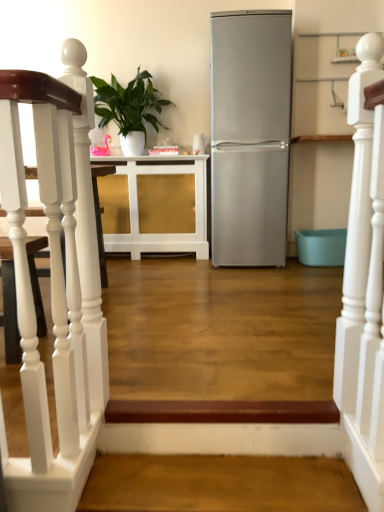
Question: Considering the relative positions of brown wood stairwell at lower center, the first stairwell positioned from the bottom, and white glossy cabinet at center in the image provided, is brown wood stairwell at lower center, the first stairwell positioned from the bottom, to the right of white glossy cabinet at center from the viewer's perspective?

Choices:
 (A) no
 (B) yes

Answer: (B)

Question: Considering the relative sizes of brown wood stairwell at lower center, the 2th stairwell when ordered from top to bottom, and white glossy cabinet at center in the image provided, is brown wood stairwell at lower center, the 2th stairwell when ordered from top to bottom, thinner than white glossy cabinet at center?

Choices:
 (A) yes
 (B) no

Answer: (A)

Question: Could you tell me if brown wood stairwell at lower center, which is the 2th stairwell in left-to-right order, is facing white glossy cabinet at center?

Choices:
 (A) no
 (B) yes

Answer: (A)

Question: Does brown wood stairwell at lower center, the first stairwell positioned from the bottom, touch white glossy cabinet at center?

Choices:
 (A) no
 (B) yes

Answer: (A)

Question: Can you confirm if brown wood stairwell at lower center, the first stairwell positioned from the bottom, is shorter than white glossy cabinet at center?

Choices:
 (A) no
 (B) yes

Answer: (B)

Question: Is white wooden staircase at left, placed as the second stairwell when sorted from bottom to top, inside the boundaries of brown wood stairwell at lower center, which is the 2th stairwell in left-to-right order, or outside?

Choices:
 (A) outside
 (B) inside

Answer: (A)

Question: From the image's perspective, relative to brown wood stairwell at lower center, the first stairwell viewed from the right, is white wooden staircase at left, placed as the second stairwell when sorted from bottom to top, above or below?

Choices:
 (A) below
 (B) above

Answer: (B)

Question: Is point (62, 334) positioned closer to the camera than point (102, 503)?

Choices:
 (A) closer
 (B) farther

Answer: (A)

Question: Looking at the image, does white wooden staircase at left, acting as the 1th stairwell starting from the top, seem bigger or smaller compared to brown wood stairwell at lower center, the first stairwell positioned from the bottom?

Choices:
 (A) small
 (B) big

Answer: (B)

Question: Relative to satin silver refrigerator at center, is brown wood stairwell at lower center, the 2th stairwell when ordered from top to bottom, in front or behind?

Choices:
 (A) front
 (B) behind

Answer: (A)

Question: In terms of size, does brown wood stairwell at lower center, the 2th stairwell when ordered from top to bottom, appear bigger or smaller than satin silver refrigerator at center?

Choices:
 (A) big
 (B) small

Answer: (B)

Question: Is brown wood stairwell at lower center, the first stairwell viewed from the right, taller or shorter than satin silver refrigerator at center?

Choices:
 (A) tall
 (B) short

Answer: (B)

Question: From a real-world perspective, relative to satin silver refrigerator at center, is brown wood stairwell at lower center, which is the 2th stairwell in left-to-right order, vertically above or below?

Choices:
 (A) below
 (B) above

Answer: (A)

Question: From a real-world perspective, is white wooden railing at upper right above or below white glossy cabinet at center?

Choices:
 (A) below
 (B) above

Answer: (B)

Question: Is point (334, 398) positioned closer to the camera than point (120, 248)?

Choices:
 (A) farther
 (B) closer

Answer: (B)